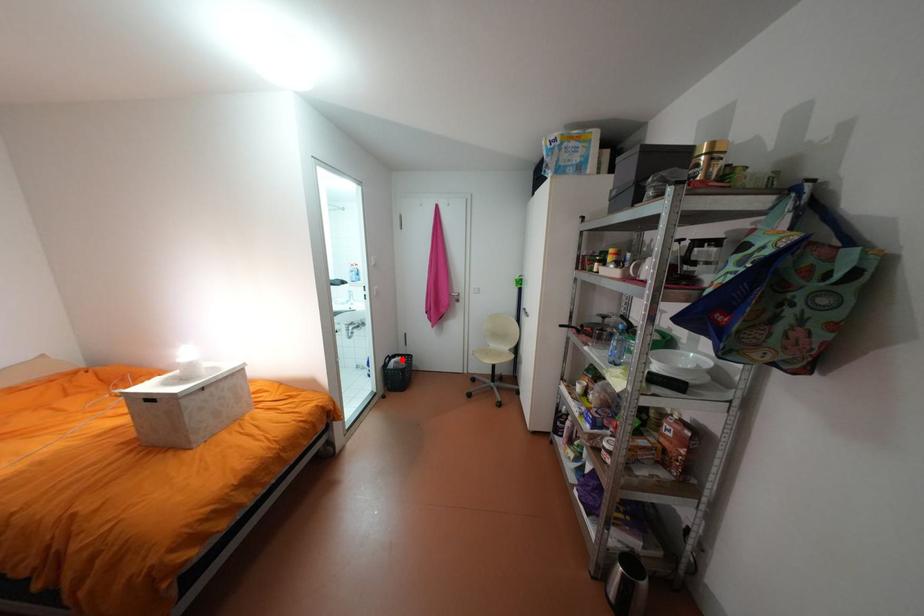
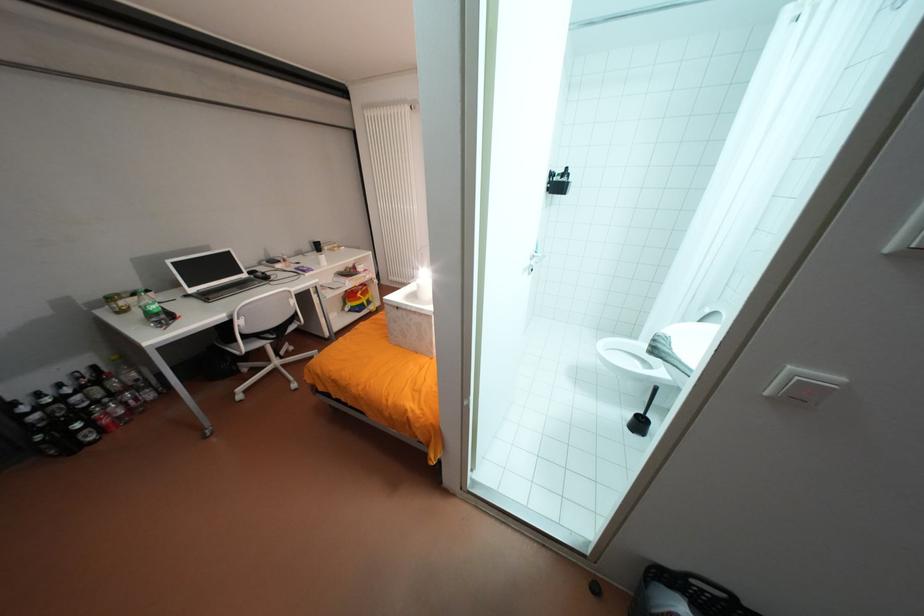
Find the pixel in the second image that matches the highlighted location in the first image.

(694, 609)